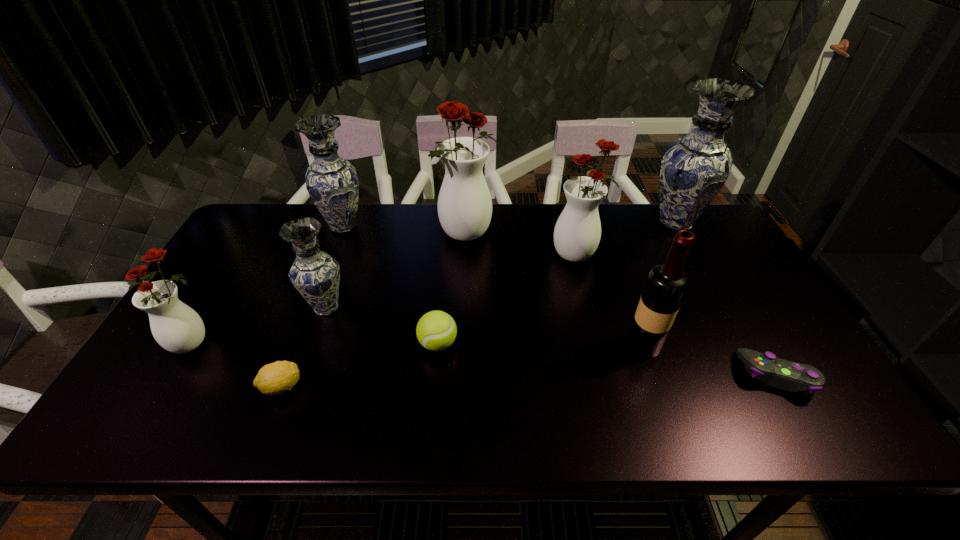
Locate an element on the screen. Image resolution: width=960 pixels, height=540 pixels. vase that is the third nearest to the rightmost red vase is located at coordinates (315, 274).

Identify which blue vase is the nearest to the green tennis ball. Please provide its 2D coordinates. Your answer should be formatted as a tuple, i.e. [(x, y)], where the tuple contains the x and y coordinates of a point satisfying the conditions above.

[(315, 274)]

Find the location of a particular element. This screenshot has height=540, width=960. the closest blue vase relative to the biggest blue vase is located at coordinates (332, 183).

Locate an element on the screen. The width and height of the screenshot is (960, 540). the second closest red vase to the gray control is located at coordinates (464, 206).

At what (x,y) coordinates should I click in order to perform the action: click on red vase that can be found as the second closest to the nearest blue vase. Please return your answer as a coordinate pair (x, y). The height and width of the screenshot is (540, 960). Looking at the image, I should click on (464, 206).

The image size is (960, 540). In order to click on vacant space that satisfies the following two spatial constraints: 1. on the front side of the second smallest blue vase; 2. at the stem end of the lemon in this screenshot , I will do `click(284, 387)`.

You are a GUI agent. You are given a task and a screenshot of the screen. Output one action in this format:
    pyautogui.click(x=<x>, y=<y>)
    Task: Click on the free space that satisfies the following two spatial constraints: 1. on the back side of the rightmost red vase; 2. on the left side of the second nearest vase
    The height and width of the screenshot is (540, 960).
    Given the screenshot: What is the action you would take?
    pyautogui.click(x=345, y=255)

Find the location of a particular element. The image size is (960, 540). vacant area in the image that satisfies the following two spatial constraints: 1. on the back side of the rightmost red vase; 2. on the left side of the rightmost vase is located at coordinates tap(570, 224).

Find the location of a particular element. The height and width of the screenshot is (540, 960). free space that satisfies the following two spatial constraints: 1. on the front side of the second biggest blue vase; 2. on the right side of the third vase from right to left is located at coordinates (341, 235).